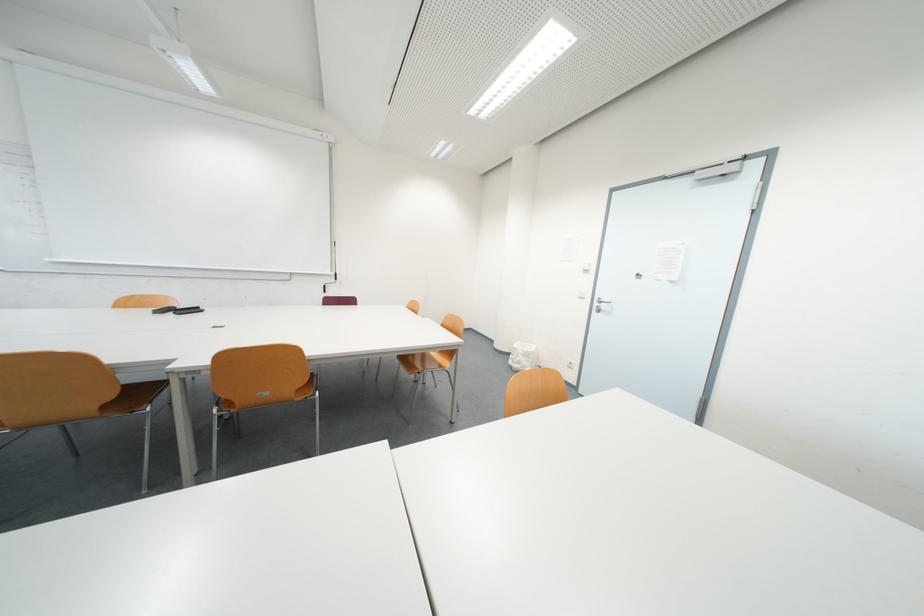
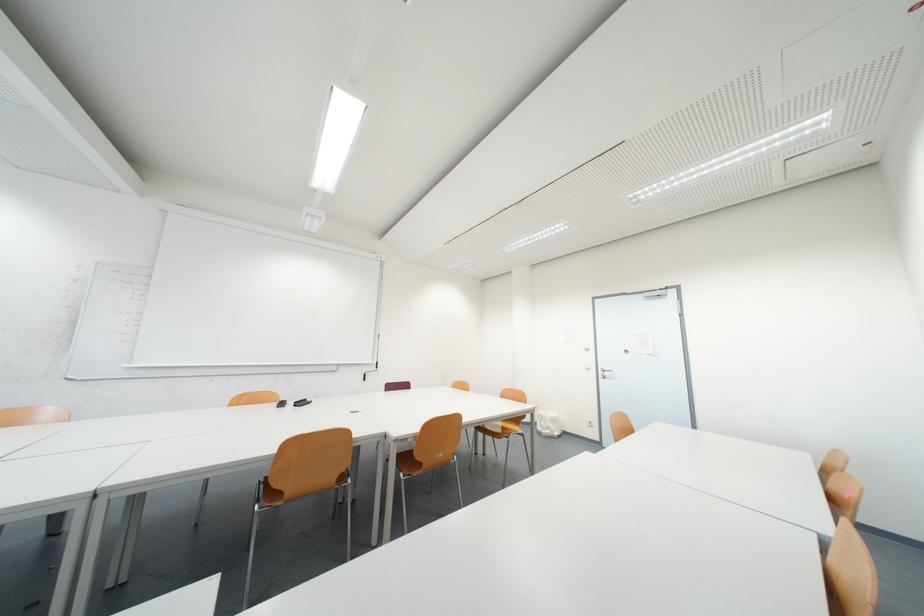
What movement of the cameraman would produce the second image?

The cameraman walked toward left, backward.